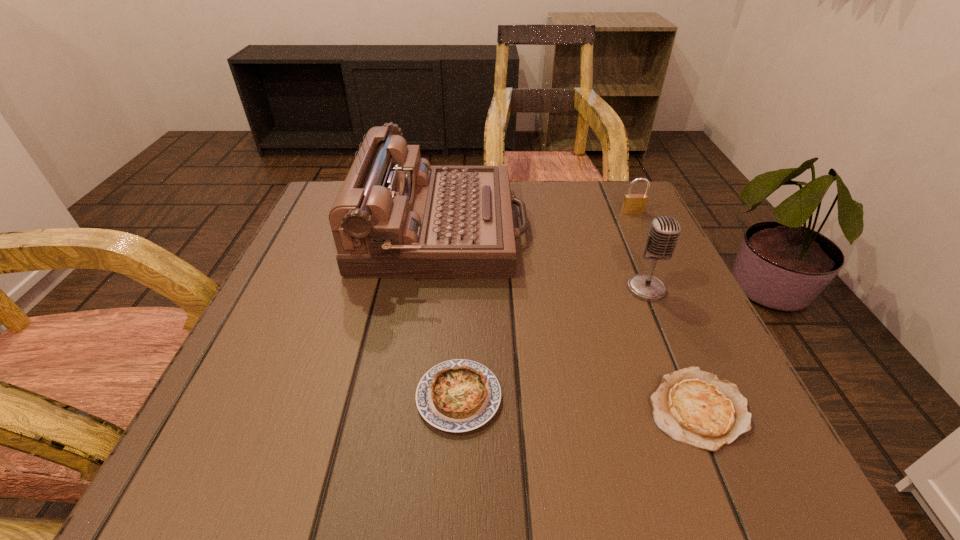
Find the location of a particular element. The height and width of the screenshot is (540, 960). free space that satisfies the following two spatial constraints: 1. on the back side of the left quiche; 2. on the keyboard of the tallest object is located at coordinates (466, 228).

Find the location of a particular element. vacant region that satisfies the following two spatial constraints: 1. on the keyboard of the shortest object; 2. on the left side of the tallest object is located at coordinates (422, 408).

At what (x,y) coordinates should I click in order to perform the action: click on vacant space that satisfies the following two spatial constraints: 1. on the keyboard of the tallest object; 2. on the right side of the microphone. Please return your answer as a coordinate pair (x, y). Looking at the image, I should click on (436, 289).

Where is `free space that satisfies the following two spatial constraints: 1. on the front-facing side of the third shortest object; 2. on the keyboard of the typewriter`? free space that satisfies the following two spatial constraints: 1. on the front-facing side of the third shortest object; 2. on the keyboard of the typewriter is located at coordinates (640, 228).

What are the coordinates of `free location that satisfies the following two spatial constraints: 1. on the keyboard of the tallest object; 2. on the right side of the shorter quiche` in the screenshot? It's located at (422, 408).